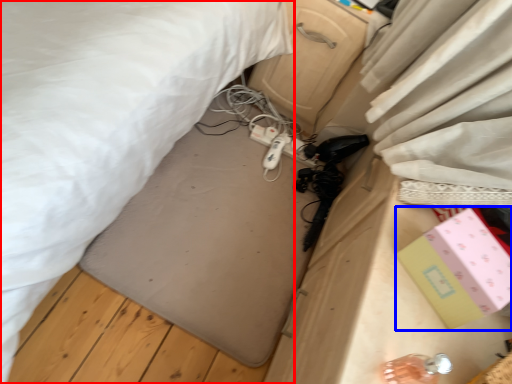
Question: Which of the following is the closest to the observer, bed (highlighted by a red box) or box (highlighted by a blue box)?

Choices:
 (A) bed
 (B) box

Answer: (A)